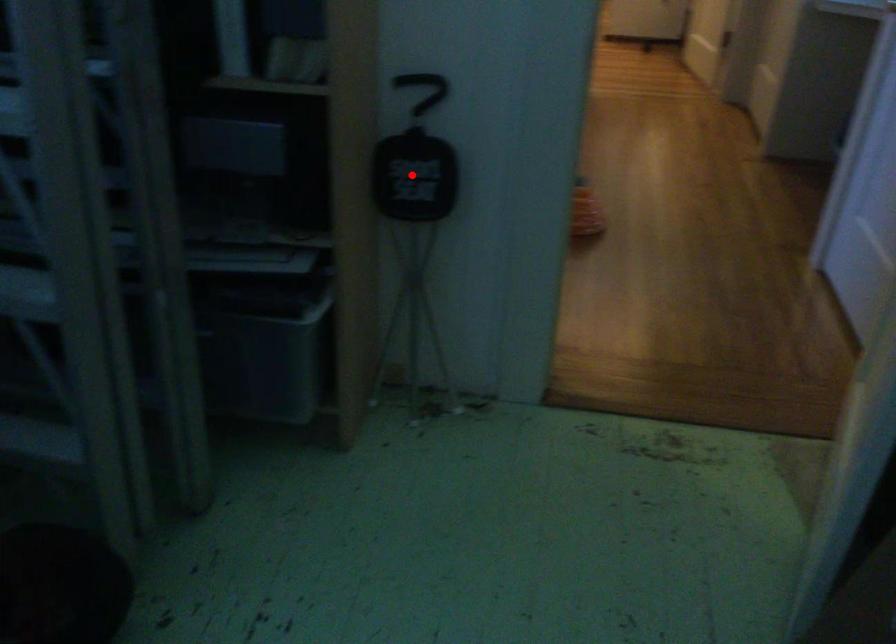
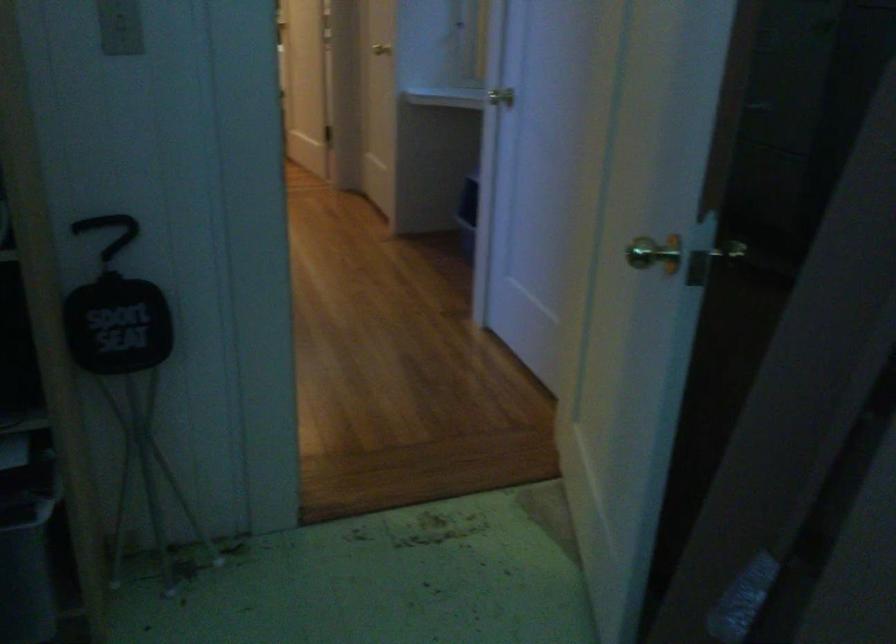
Question: I am providing you with two images of the same scene from different viewpoints. Given a red point in image1, look at the same physical point in image2. Is it:

Choices:
 (A) Closer to the viewpoint
 (B) Farther from the viewpoint

Answer: (A)